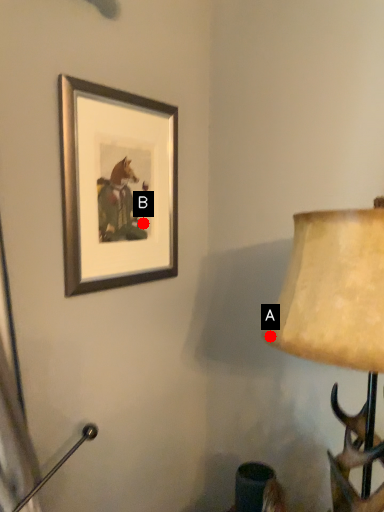
Question: Two points are circled on the image, labeled by A and B beside each circle. Which point is closer to the camera?

Choices:
 (A) A is closer
 (B) B is closer

Answer: (A)